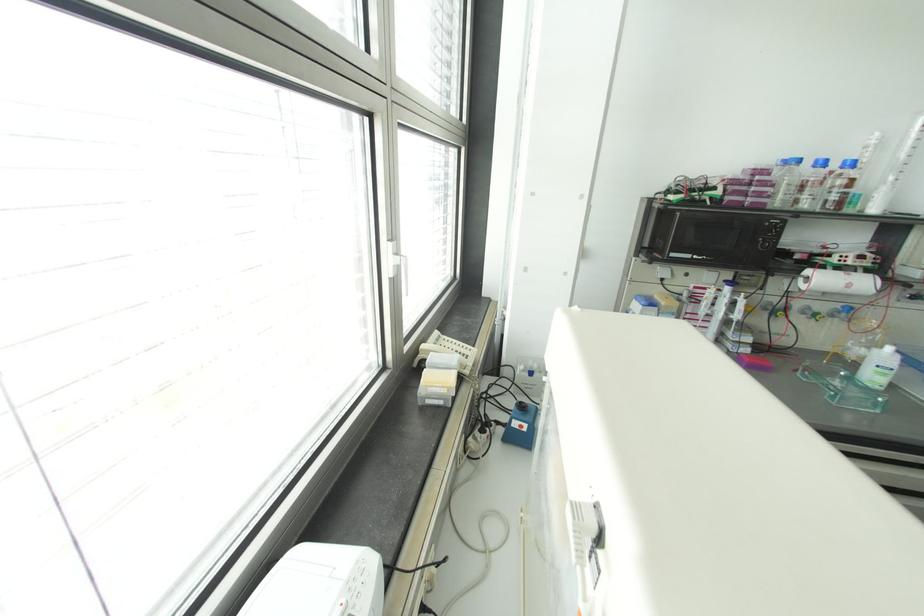
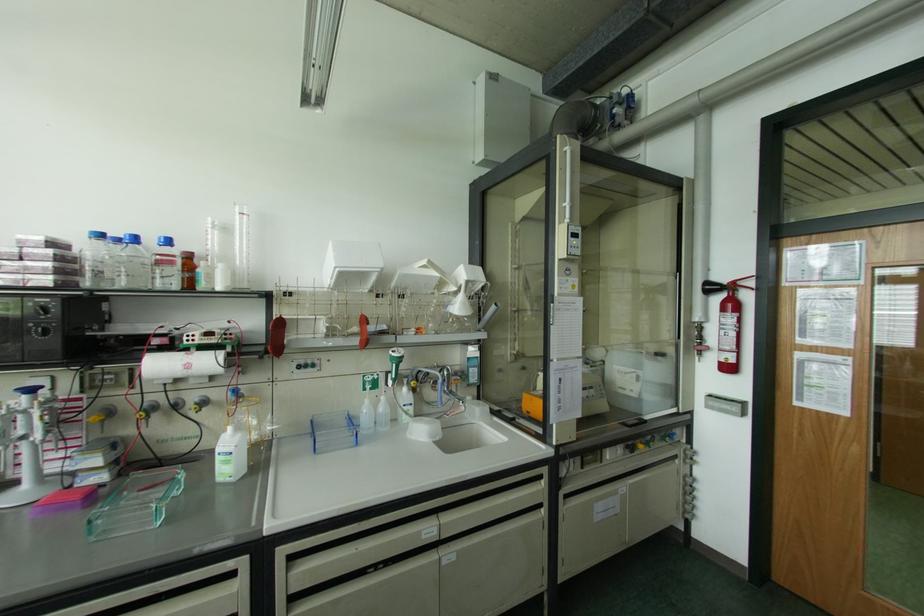
The point at [852,163] is marked in the first image. Where is the corresponding point in the second image?

(167, 241)